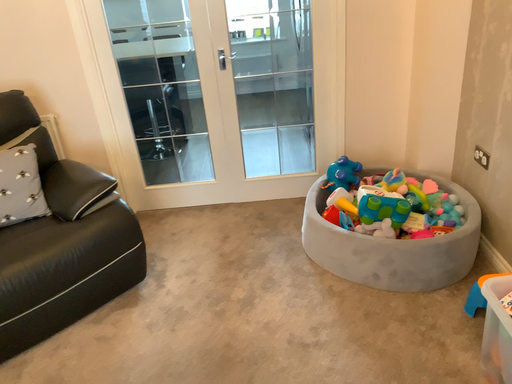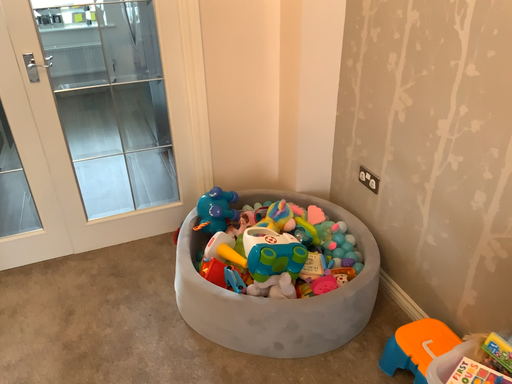
Question: How did the camera likely rotate when shooting the video?

Choices:
 (A) rotated left
 (B) rotated right

Answer: (B)